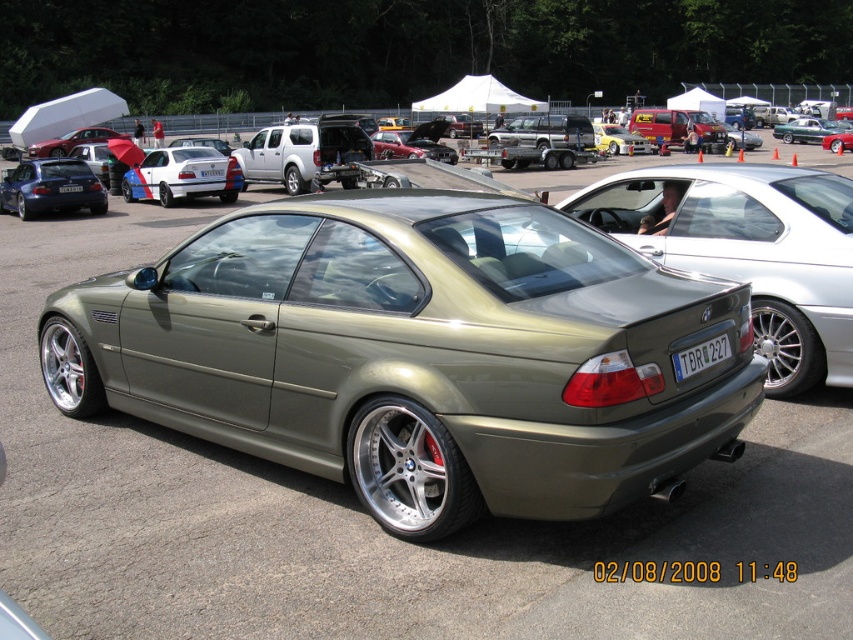
You are a photographer setting up a shot of the BMW sports car. You need to position your camera so that both the matte black car at left and the blue plastic license plate at rear are visible in the frame. Considering their sizes, which object will appear bigger in the photo?

The matte black car at left will appear bigger in the photo because it is larger in size than the blue plastic license plate at rear.

You are a photographer positioned at the center of the car exhibition. You want to take a photo of the blue plastic license plate at rear but need to avoid the matte black car at left blocking the view. Which direction should you move to ensure the license plate is visible?

The matte black car at left is to the left of the blue plastic license plate at rear. To avoid the matte black car at left blocking the view, you should move to the right side so that the blue plastic license plate at rear becomes visible.